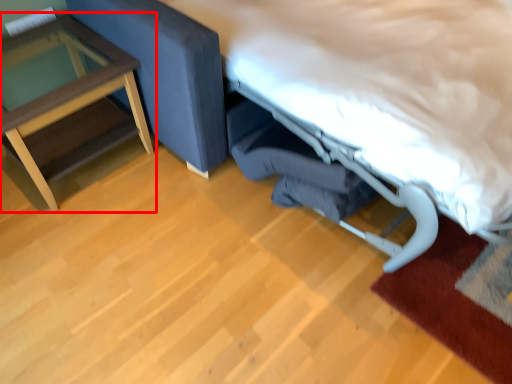
Question: Where is table (annotated by the red box) located in relation to bed in the image?

Choices:
 (A) left
 (B) right

Answer: (A)